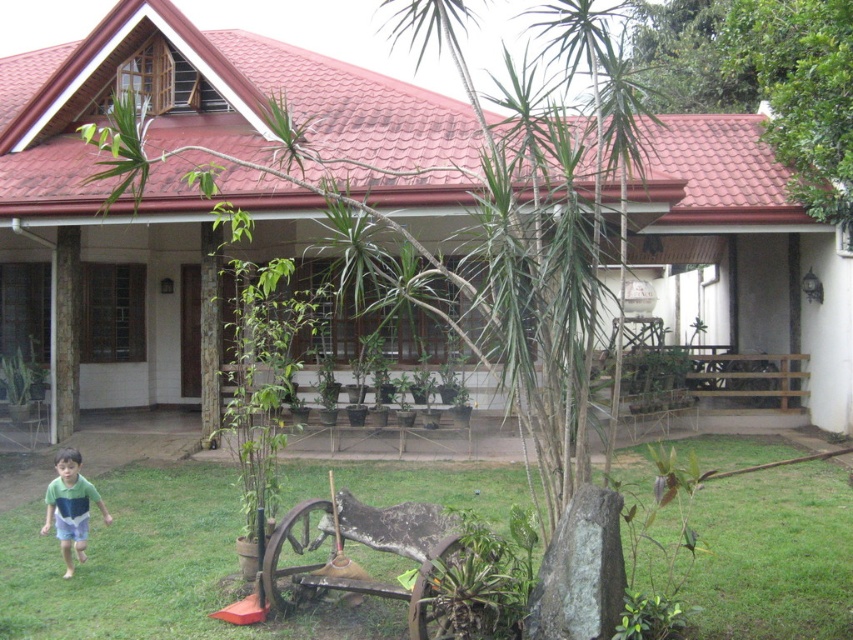
Question: Which point is farther from the camera taking this photo?

Choices:
 (A) (45, 518)
 (B) (173, 627)

Answer: (A)

Question: Is green grass at lower left thinner than green cotton shirt at lower left?

Choices:
 (A) no
 (B) yes

Answer: (B)

Question: Is green grass at lower left behind green cotton shirt at lower left?

Choices:
 (A) no
 (B) yes

Answer: (B)

Question: Does green grass at lower left have a larger size compared to green cotton shirt at lower left?

Choices:
 (A) no
 (B) yes

Answer: (A)

Question: Which point is closer to the camera taking this photo?

Choices:
 (A) (49, 502)
 (B) (489, 468)

Answer: (A)

Question: Which point is farther from the camera taking this photo?

Choices:
 (A) (811, 490)
 (B) (76, 508)

Answer: (A)